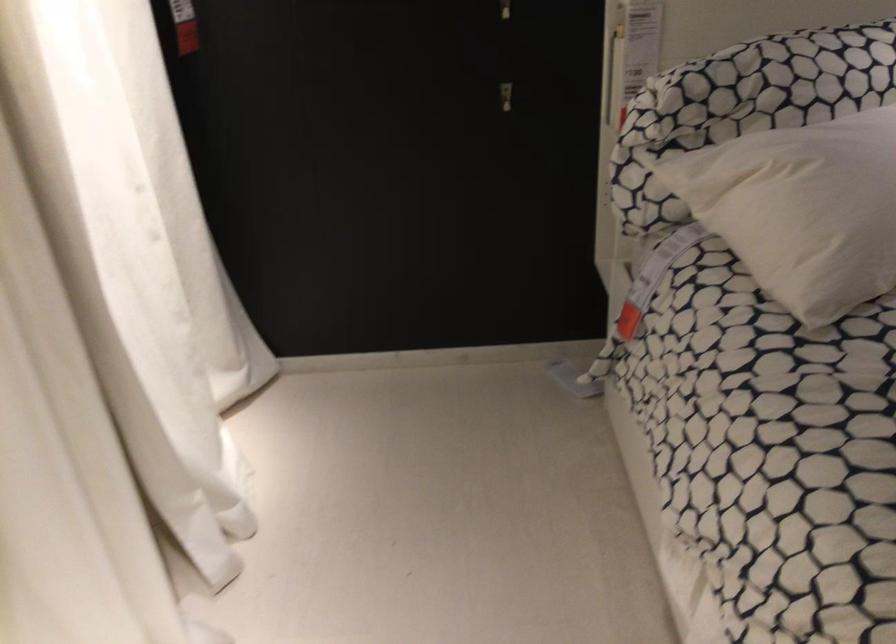
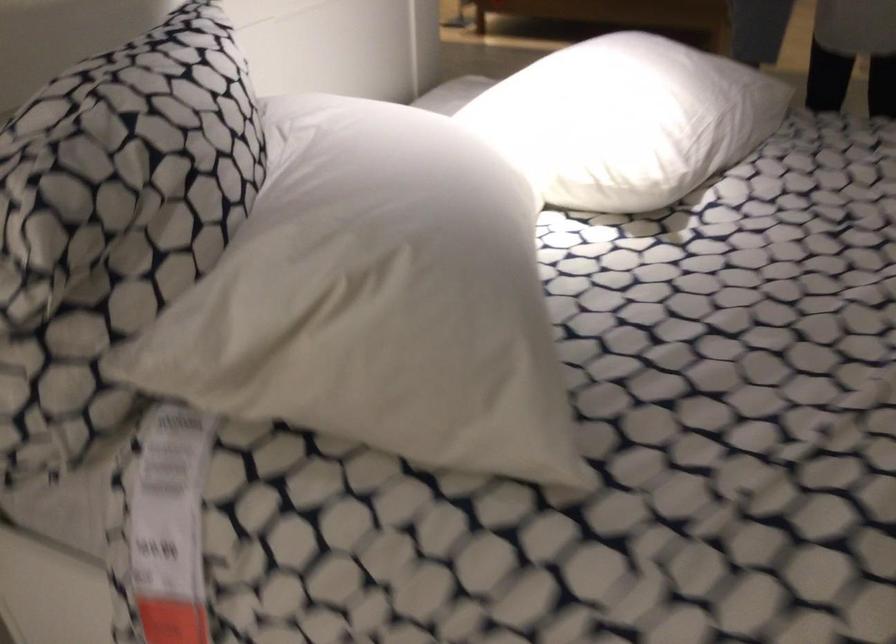
Locate, in the second image, the point that corresponds to (x=652, y=277) in the first image.

(169, 526)